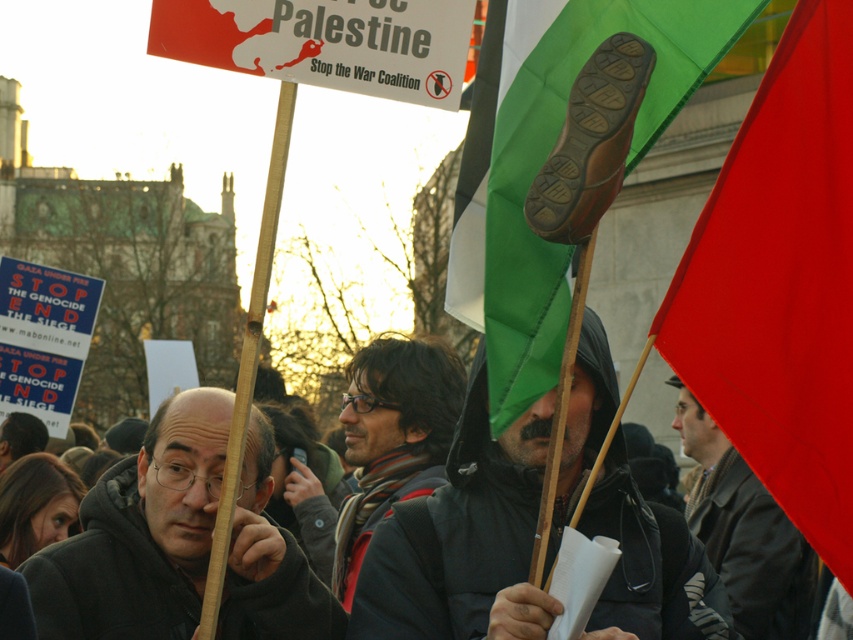
You are a photographer standing at the protest scene. You want to take a closeup shot of the green fabric flag at upper center. Based on the distance provided, is it feasible to capture a clear closeup without moving closer?

The green fabric flag at upper center is 58.95 meters away from the viewer. A standard camera lens can capture clear closeups at this distance, so it is feasible to take a clear photo without moving closer.

You are a photographer standing at the center of the protest scene. You want to take a photo that includes both the point at coordinates point (793, 438) and point (259, 589). Which point should you focus on first to ensure both are in frame?

You should focus on point (259, 589) first because it is behind point (793, 438). By focusing on the farther point, both points will be in focus due to the depth of field.

You are a photographer trying to capture the protest scene. You have a camera with a 50mm lens, which has a fixed field of view. You want to include both the red fabric flag at upper right and the matte black hoodie at center in your shot. Given their sizes in the image, will the flag be wider or narrower than the hoodie in the photo?

The red fabric flag at upper right has a lesser width compared to matte black hoodie at center, so in the photo, the flag will appear narrower than the hoodie.